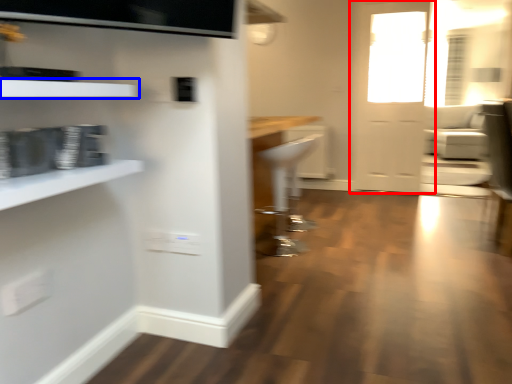
Question: Which of the following is the closest to the observer, door (highlighted by a red box) or shelf (highlighted by a blue box)?

Choices:
 (A) door
 (B) shelf

Answer: (B)